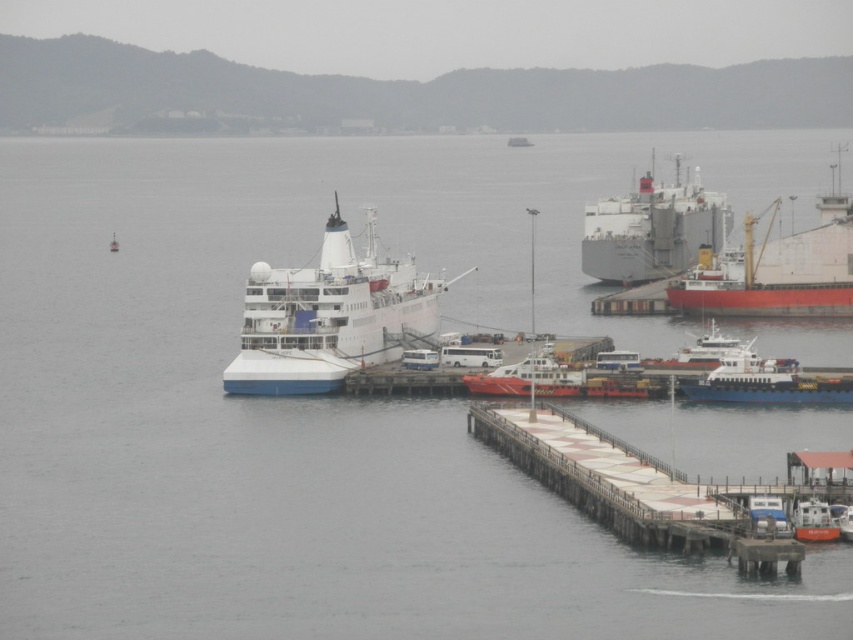
Question: Does brown wooden dock at lower right have a greater width compared to orange matte boat at lower right?

Choices:
 (A) no
 (B) yes

Answer: (B)

Question: Which of the following is the closest to the observer?

Choices:
 (A) (575, 394)
 (B) (762, 388)
 (C) (335, 205)

Answer: (B)

Question: Among these objects, which one is farthest from the camera?

Choices:
 (A) red matte cargo ship at right
 (B) brown wooden dock at lower right

Answer: (A)

Question: Does orange matte boat at lower right appear on the left side of white glossy boat at center?

Choices:
 (A) yes
 (B) no

Answer: (A)

Question: Is red matte cargo ship at right below white glossy boat at center?

Choices:
 (A) no
 (B) yes

Answer: (A)

Question: Which object is the farthest from the white glossy boat at center?

Choices:
 (A) orange matte boat at lower right
 (B) white matte ship at center
 (C) white matte cargo ship at center right

Answer: (C)